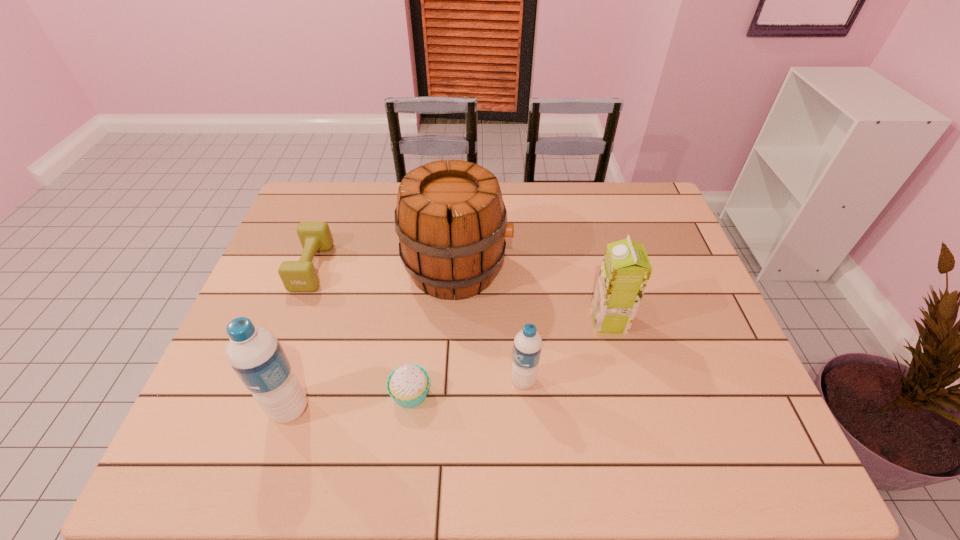
Locate an element on the screen. The height and width of the screenshot is (540, 960). dumbbell present at the left edge is located at coordinates (297, 276).

In order to click on object present at the near left corner in this screenshot , I will do `click(255, 354)`.

You are a GUI agent. You are given a task and a screenshot of the screen. Output one action in this format:
    pyautogui.click(x=<x>, y=<y>)
    Task: Click on the vacant space at the far edge of the desktop
    
    Given the screenshot: What is the action you would take?
    pyautogui.click(x=571, y=194)

The width and height of the screenshot is (960, 540). In the image, there is a desktop. Identify the location of vacant space at the near edge. (574, 418).

Identify the location of vacant space at the left edge of the desktop. (264, 302).

Identify the location of vacant space at the right edge of the desktop. The width and height of the screenshot is (960, 540). click(x=711, y=336).

This screenshot has height=540, width=960. Find the location of `vacant area at the far right corner of the desktop`. vacant area at the far right corner of the desktop is located at coordinates (609, 183).

The image size is (960, 540). What are the coordinates of `empty space between the shortest object and the cupcake` in the screenshot? It's located at (361, 330).

The width and height of the screenshot is (960, 540). What are the coordinates of `free area in between the rightmost object and the taller water bottle` in the screenshot? It's located at (449, 365).

Where is `vacant area that lies between the cupcake and the shortest object`? This screenshot has width=960, height=540. vacant area that lies between the cupcake and the shortest object is located at coordinates (361, 330).